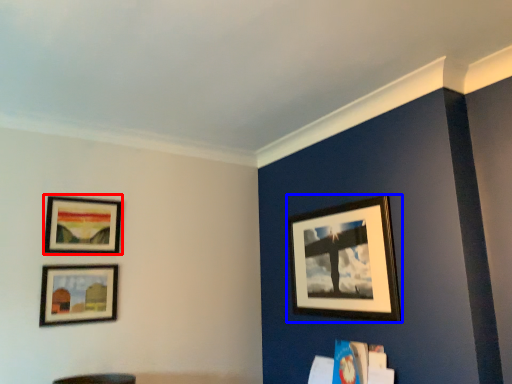
Question: Among these objects, which one is nearest to the camera, picture frame (highlighted by a red box) or picture frame (highlighted by a blue box)?

Choices:
 (A) picture frame
 (B) picture frame

Answer: (B)